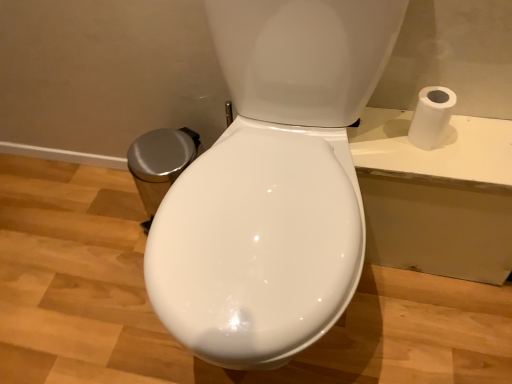
This screenshot has height=384, width=512. I want to click on white matte toilet paper at upper right, so click(431, 116).

The height and width of the screenshot is (384, 512). What do you see at coordinates (431, 116) in the screenshot?
I see `white matte toilet paper at upper right` at bounding box center [431, 116].

The image size is (512, 384). I want to click on white matte toilet paper at upper right, so click(x=431, y=116).